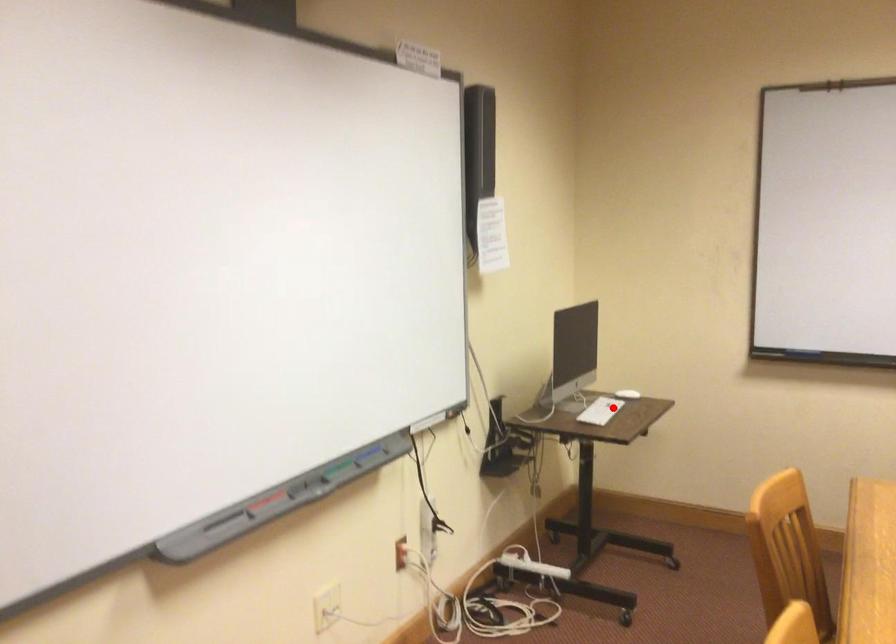
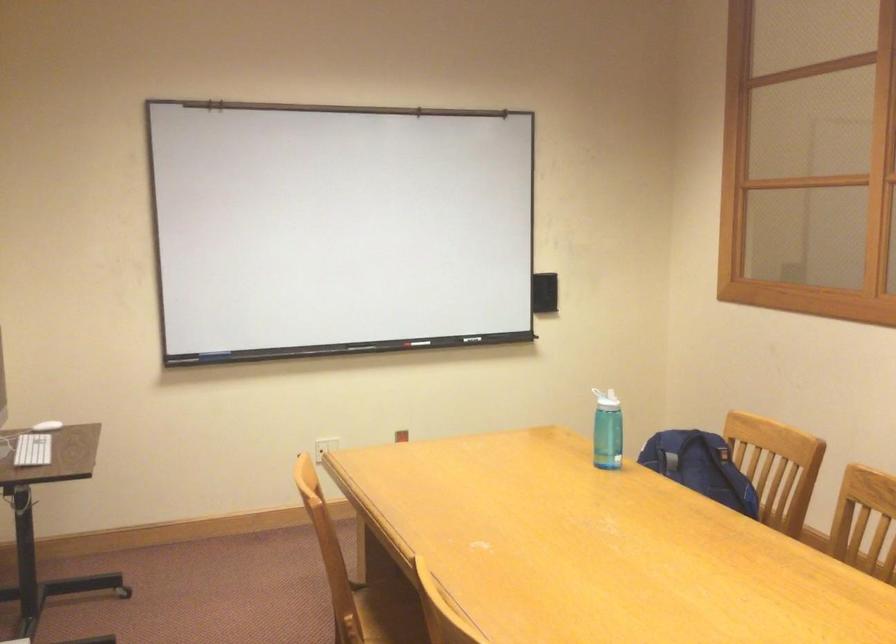
Find the pixel in the second image that matches the highlighted location in the first image.

(32, 450)